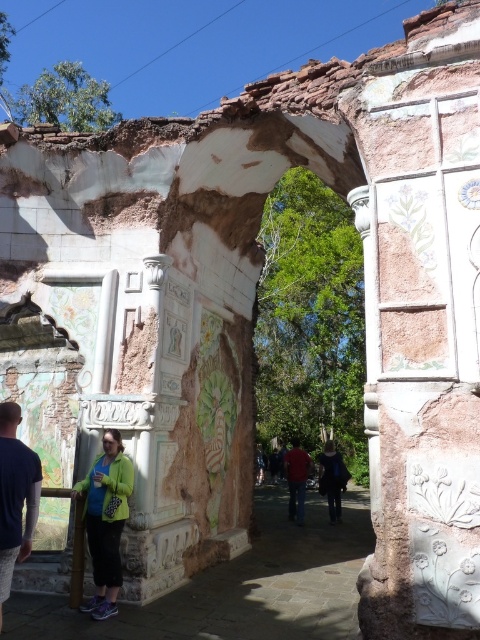
Is dark blue textured shirt at center thinner than red matte shirt at center?

Incorrect, dark blue textured shirt at center's width is not less than red matte shirt at center's.

Is dark blue textured shirt at center to the left of red matte shirt at center from the viewer's perspective?

Yes, dark blue textured shirt at center is to the left of red matte shirt at center.

Does point (13, 465) come in front of point (296, 444)?

Yes, point (13, 465) is closer to viewer.

I want to click on dark blue textured shirt at center, so click(x=14, y=496).

Can you confirm if green matte jacket at center is wider than dark blue textured shirt at center?

Yes, green matte jacket at center is wider than dark blue textured shirt at center.

Which of these two, green matte jacket at center or dark blue textured shirt at center, stands shorter?

With less height is dark blue textured shirt at center.

Which is behind, point (109, 500) or point (0, 460)?

Positioned behind is point (109, 500).

The height and width of the screenshot is (640, 480). In order to click on green matte jacket at center in this screenshot , I will do `click(106, 520)`.

Is green matte jacket at center above dark blue jeans at center?

Yes, green matte jacket at center is above dark blue jeans at center.

The height and width of the screenshot is (640, 480). Find the location of `green matte jacket at center`. green matte jacket at center is located at coordinates tap(106, 520).